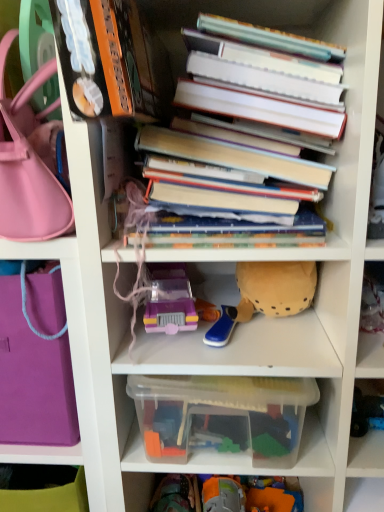
Question: Can you confirm if hardcover books at center is positioned to the right of purple fabric bag at left, arranged as the second handbag when viewed from the top?

Choices:
 (A) no
 (B) yes

Answer: (B)

Question: Considering the relative positions of hardcover books at center and purple fabric bag at left, which is the first handbag in bottom-to-top order, in the image provided, is hardcover books at center to the left of purple fabric bag at left, which is the first handbag in bottom-to-top order, from the viewer's perspective?

Choices:
 (A) no
 (B) yes

Answer: (A)

Question: Does hardcover books at center come in front of purple fabric bag at left, which is the first handbag in bottom-to-top order?

Choices:
 (A) no
 (B) yes

Answer: (B)

Question: From the image's perspective, is hardcover books at center on purple fabric bag at left, arranged as the second handbag when viewed from the top?

Choices:
 (A) no
 (B) yes

Answer: (B)

Question: Is hardcover books at center outside of purple fabric bag at left, which is the first handbag in bottom-to-top order?

Choices:
 (A) yes
 (B) no

Answer: (A)

Question: Looking at the image, does hardcover books at center seem bigger or smaller compared to matte pink handbag at left, positioned as the 2th handbag in bottom-to-top order?

Choices:
 (A) big
 (B) small

Answer: (A)

Question: Is hardcover books at center taller or shorter than matte pink handbag at left, which appears as the first handbag when viewed from the top?

Choices:
 (A) short
 (B) tall

Answer: (B)

Question: Is hardcover books at center spatially inside matte pink handbag at left, positioned as the 2th handbag in bottom-to-top order, or outside of it?

Choices:
 (A) inside
 (B) outside

Answer: (B)

Question: From a real-world perspective, is hardcover books at center physically located above or below matte pink handbag at left, positioned as the 2th handbag in bottom-to-top order?

Choices:
 (A) below
 (B) above

Answer: (A)

Question: Is translucent plastic toy car at center, placed as the 1th toy when sorted from left to right, spatially inside soft yellow plush at center, marked as the 3th toy in a left-to-right arrangement, or outside of it?

Choices:
 (A) outside
 (B) inside

Answer: (A)

Question: Relative to soft yellow plush at center, marked as the 3th toy in a left-to-right arrangement, is translucent plastic toy car at center, positioned as the third toy in right-to-left order, in front or behind?

Choices:
 (A) front
 (B) behind

Answer: (A)

Question: Looking at the image, does translucent plastic toy car at center, placed as the 1th toy when sorted from left to right, seem bigger or smaller compared to soft yellow plush at center, marked as the 3th toy in a left-to-right arrangement?

Choices:
 (A) big
 (B) small

Answer: (B)

Question: From the image's perspective, is translucent plastic toy car at center, placed as the 1th toy when sorted from left to right, located above or below soft yellow plush at center, marked as the 3th toy in a left-to-right arrangement?

Choices:
 (A) below
 (B) above

Answer: (A)

Question: Based on their positions, is clear plastic container at center located to the left or right of purple fabric bag at left, which is the first handbag in bottom-to-top order?

Choices:
 (A) left
 (B) right

Answer: (B)

Question: From the image's perspective, relative to purple fabric bag at left, arranged as the second handbag when viewed from the top, is clear plastic container at center above or below?

Choices:
 (A) above
 (B) below

Answer: (B)